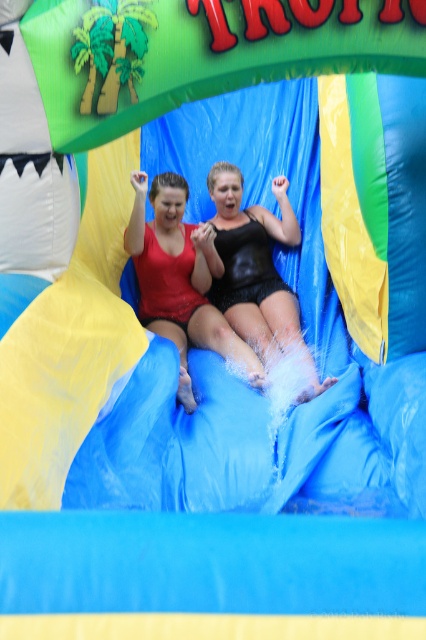
Question: Where is matte red swimsuit at center located in relation to black shiny shorts at center in the image?

Choices:
 (A) above
 (B) below

Answer: (B)

Question: Does matte red swimsuit at center appear under black shiny shorts at center?

Choices:
 (A) no
 (B) yes

Answer: (B)

Question: Among these points, which one is nearest to the camera?

Choices:
 (A) (215, 209)
 (B) (209, 323)

Answer: (B)

Question: Which point is closer to the camera taking this photo?

Choices:
 (A) (270, 340)
 (B) (213, 320)

Answer: (A)

Question: Can you confirm if matte red swimsuit at center is wider than black shiny shorts at center?

Choices:
 (A) no
 (B) yes

Answer: (B)